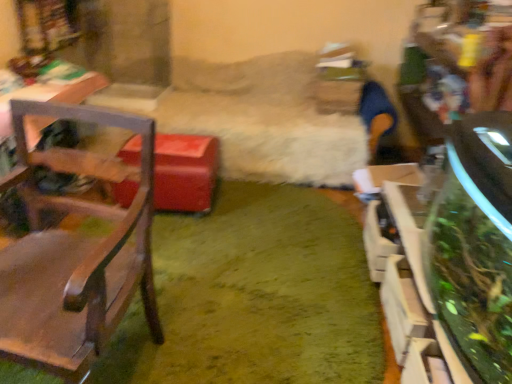
Question: Is point (472, 302) closer or farther from the camera than point (124, 236)?

Choices:
 (A) farther
 (B) closer

Answer: (A)

Question: Considering the positions of green leafy plant at right and wooden chair at left in the image, is green leafy plant at right wider or thinner than wooden chair at left?

Choices:
 (A) wide
 (B) thin

Answer: (B)

Question: Which of these objects is positioned farthest from the green plush carpet at center?

Choices:
 (A) wooden chair at left
 (B) green leafy plant at right

Answer: (B)

Question: Considering the real-world distances, which object is farthest from the green leafy plant at right?

Choices:
 (A) wooden chair at left
 (B) green plush carpet at center

Answer: (A)